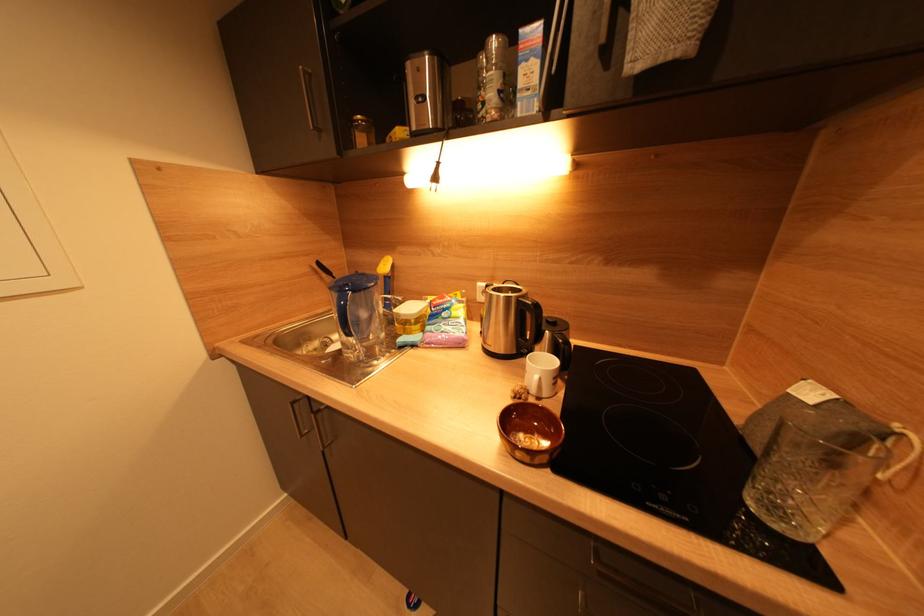
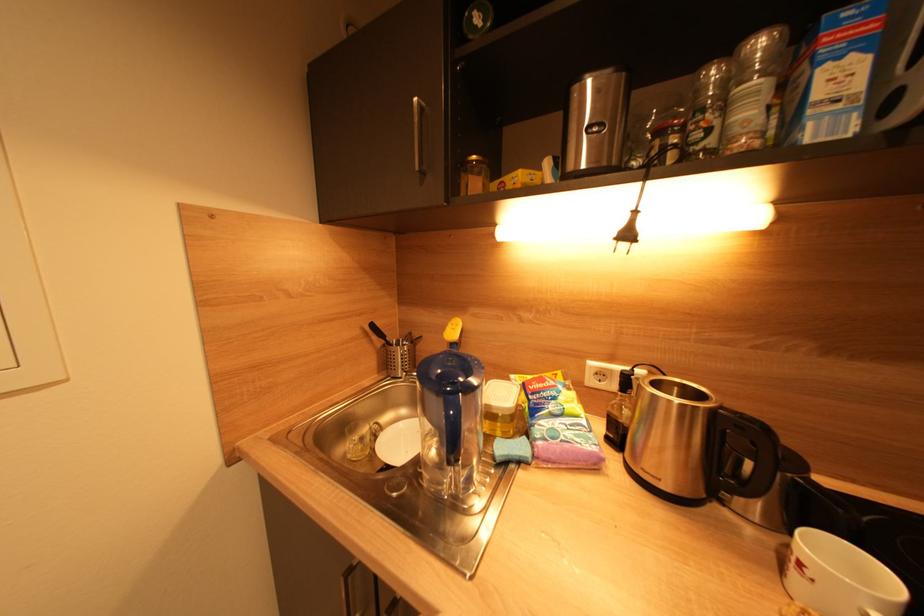
Question: The images are taken continuously from a first-person perspective. In which direction is your viewpoint rotating?

Choices:
 (A) Left
 (B) Right
 (C) Up
 (D) Down

Answer: (C)